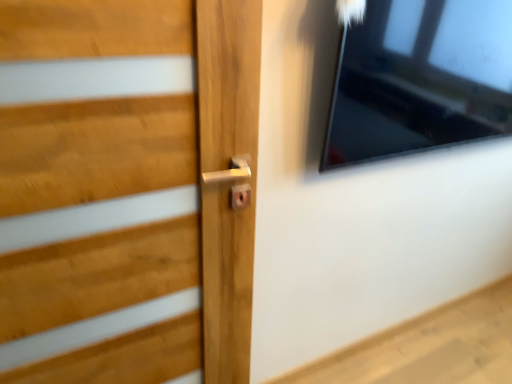
Question: Considering the relative sizes of wooden door handle at center and transparent glass window at upper right in the image provided, is wooden door handle at center taller than transparent glass window at upper right?

Choices:
 (A) no
 (B) yes

Answer: (B)

Question: From the image's perspective, is wooden door handle at center located above transparent glass window at upper right?

Choices:
 (A) yes
 (B) no

Answer: (B)

Question: Is wooden door handle at center turned away from transparent glass window at upper right?

Choices:
 (A) no
 (B) yes

Answer: (A)

Question: Is transparent glass window at upper right a part of wooden door handle at center?

Choices:
 (A) yes
 (B) no

Answer: (B)

Question: Is wooden door handle at center further to camera compared to transparent glass window at upper right?

Choices:
 (A) yes
 (B) no

Answer: (B)

Question: Can you confirm if wooden door handle at center is wider than transparent glass window at upper right?

Choices:
 (A) yes
 (B) no

Answer: (B)

Question: Is transparent glass window at upper right taller than wooden door handle at center?

Choices:
 (A) yes
 (B) no

Answer: (B)

Question: Can you confirm if transparent glass window at upper right is positioned to the left of wooden door handle at center?

Choices:
 (A) no
 (B) yes

Answer: (A)

Question: From a real-world perspective, is transparent glass window at upper right over wooden door handle at center?

Choices:
 (A) no
 (B) yes

Answer: (B)

Question: Can you confirm if transparent glass window at upper right is wider than wooden door handle at center?

Choices:
 (A) yes
 (B) no

Answer: (A)

Question: Is transparent glass window at upper right bigger than wooden door handle at center?

Choices:
 (A) no
 (B) yes

Answer: (B)

Question: Considering the relative sizes of transparent glass window at upper right and wooden door handle at center in the image provided, is transparent glass window at upper right shorter than wooden door handle at center?

Choices:
 (A) yes
 (B) no

Answer: (A)

Question: In the image, is wooden door handle at center positioned in front of or behind transparent glass window at upper right?

Choices:
 (A) behind
 (B) front

Answer: (B)